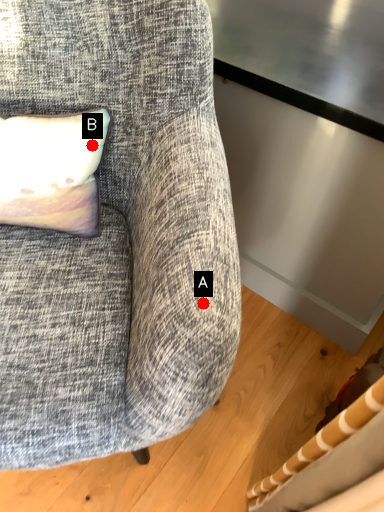
Question: Two points are circled on the image, labeled by A and B beside each circle. Which of the following is the closest to the observer?

Choices:
 (A) A is closer
 (B) B is closer

Answer: (A)